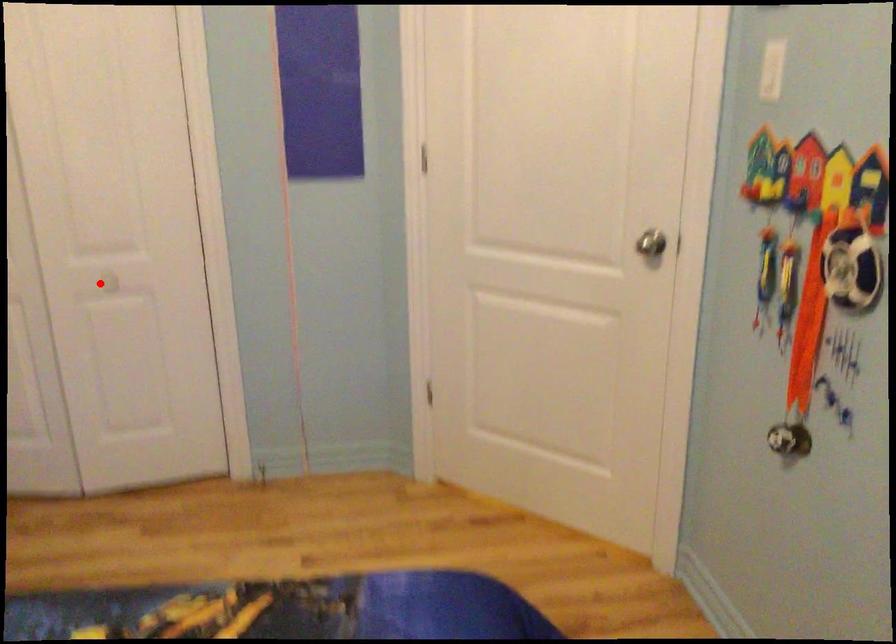
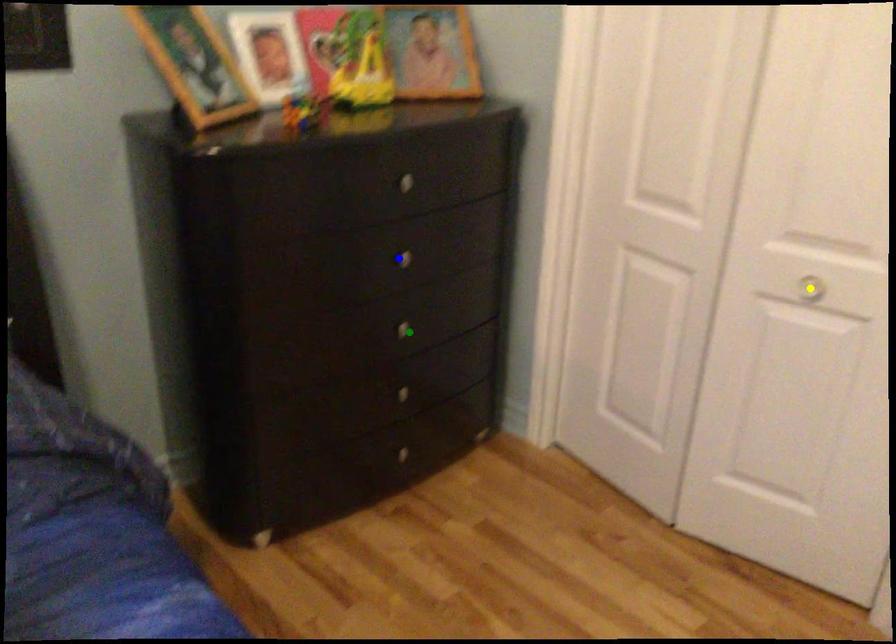
Question: I am providing you with two images of the same scene from different viewpoints. A red point is marked on the first image. You are given multiple points on the second image. Can you choose the point in image 2 that corresponds to the point in image 1?

Choices:
 (A) green point
 (B) yellow point
 (C) blue point

Answer: (B)